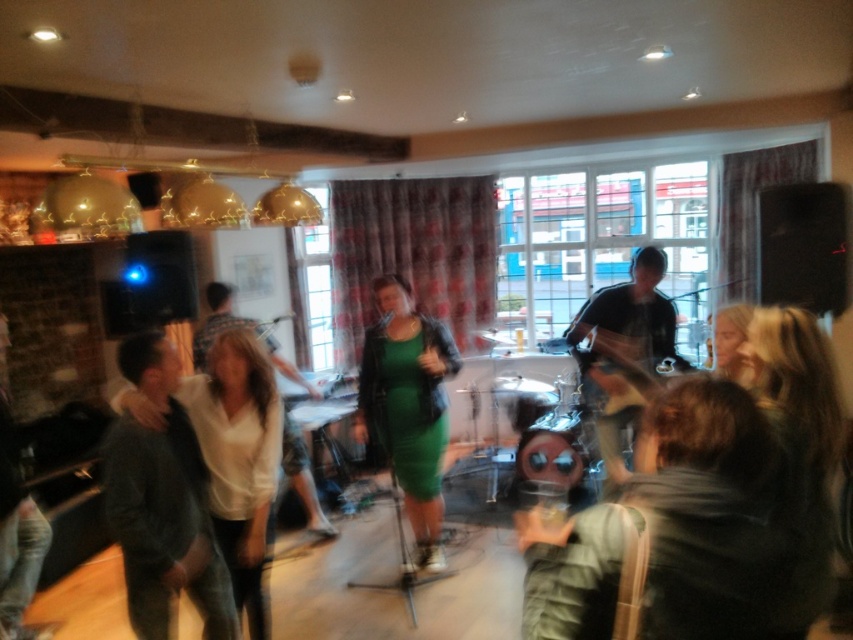
Question: Does green leather dress at center have a larger size compared to matte black shirt at center?

Choices:
 (A) yes
 (B) no

Answer: (B)

Question: Which is farther from the dark green sweater at left?

Choices:
 (A) matte black shirt at center
 (B) green leather dress at center

Answer: (A)

Question: From the image, what is the correct spatial relationship of green leather dress at center in relation to matte black shirt at center?

Choices:
 (A) left
 (B) right

Answer: (A)

Question: Which of the following is the farthest from the observer?

Choices:
 (A) white matte shirt at center
 (B) dark green sweater at left
 (C) green leather dress at center
 (D) matte black shirt at center

Answer: (A)

Question: Does dark green sweater at left have a greater width compared to matte black shirt at center?

Choices:
 (A) yes
 (B) no

Answer: (B)

Question: Which point is closer to the camera?

Choices:
 (A) white matte shirt at center
 (B) green leather dress at center

Answer: (B)